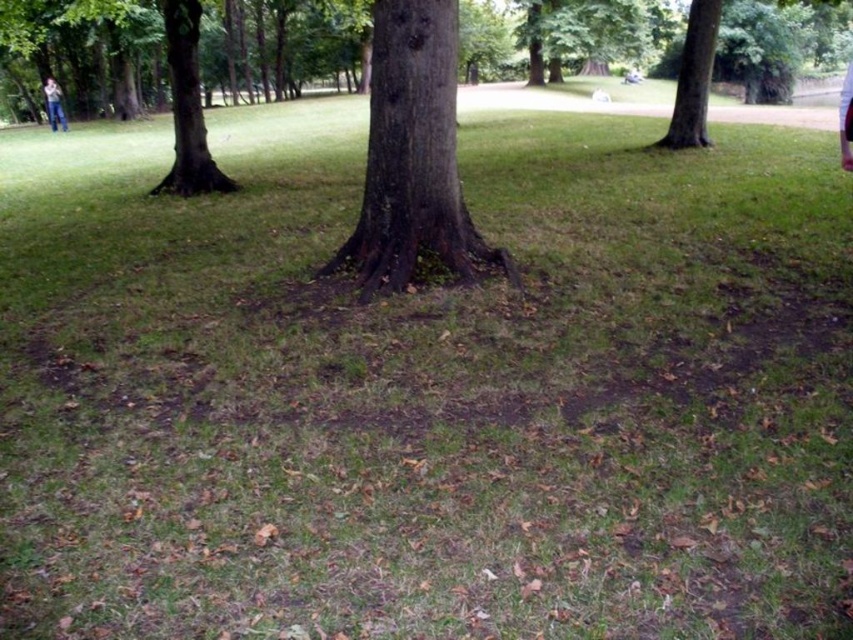
Based on the photo, you are a park ranger inspecting the trees in the park. You need to determine which tree has a thicker trunk between the dark brown bark tree at center and the smooth bark tree at upper right. Based on the scene, which one is thicker?

The smooth bark tree at upper right has a thicker trunk than the dark brown bark tree at center.

You are standing in the park and want to take a photo of both the brown rough bark tree at left and the smooth bark tree at upper right. Which tree should you position yourself closer to in order to fit both into your camera frame?

You should position yourself closer to the smooth bark tree at upper right because the brown rough bark tree at left is to the left of it, so moving closer to the one further away helps include both in the frame.